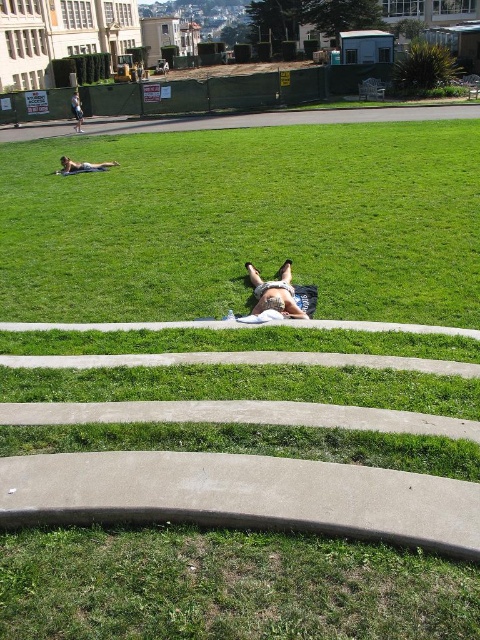
Is green grass at center below white cotton towel at center?

Incorrect, green grass at center is not positioned below white cotton towel at center.

Who is positioned more to the right, green grass at center or white cotton towel at center?

From the viewer's perspective, white cotton towel at center appears more on the right side.

Who is more forward, (x=324, y=256) or (x=287, y=289)?

Point (x=287, y=289) is more forward.

The height and width of the screenshot is (640, 480). I want to click on green grass at center, so click(245, 221).

Describe the element at coordinates (245, 221) in the screenshot. The width and height of the screenshot is (480, 640). I see `green grass at center` at that location.

Does green grass at center have a greater width compared to light brown skin at upper left?

Indeed, green grass at center has a greater width compared to light brown skin at upper left.

The image size is (480, 640). What do you see at coordinates (245, 221) in the screenshot?
I see `green grass at center` at bounding box center [245, 221].

This screenshot has height=640, width=480. Identify the location of green grass at center. (245, 221).

Between white cotton towel at center and light brown skin at upper left, which one appears on the right side from the viewer's perspective?

white cotton towel at center is more to the right.

Between white cotton towel at center and light brown skin at upper left, which one has more height?

With more height is white cotton towel at center.

In order to click on white cotton towel at center in this screenshot , I will do `click(282, 292)`.